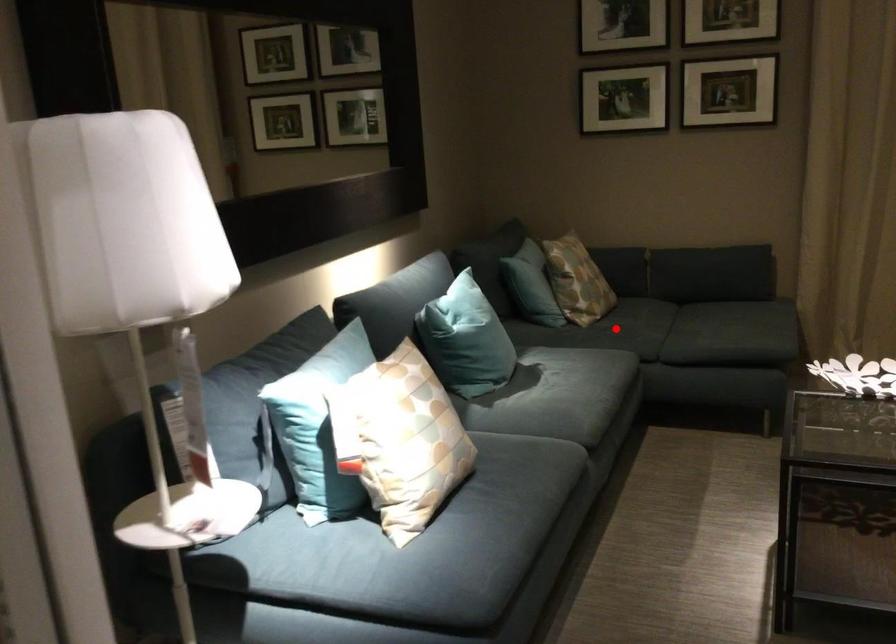
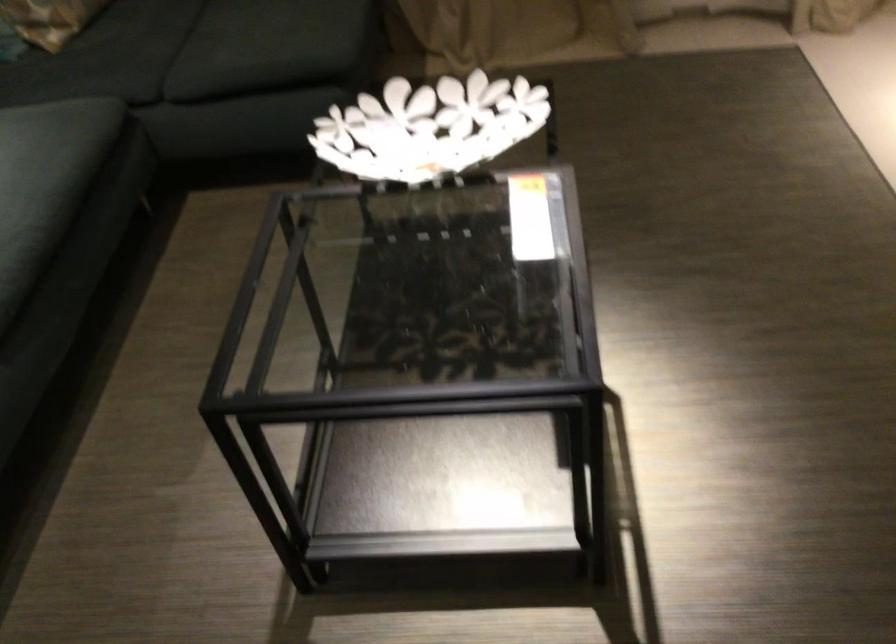
Question: I am providing you with two images of the same scene from different viewpoints. Image1 has a red point marked. In image2, the corresponding 3D location appears at what relative position? Reply with the corresponding letter.

Choices:
 (A) Closer
 (B) Farther

Answer: (A)